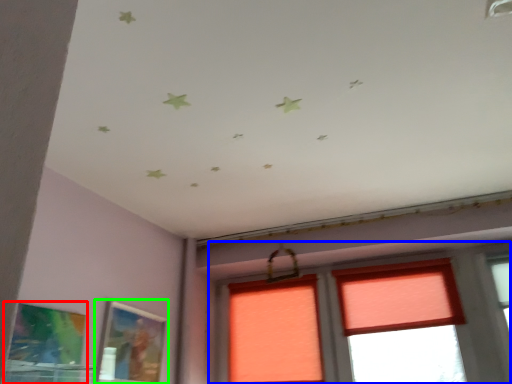
Question: Considering the real-world distances, which object is farthest from picture frame (highlighted by a red box)? window (highlighted by a blue box) or picture frame (highlighted by a green box)?

Choices:
 (A) window
 (B) picture frame

Answer: (A)